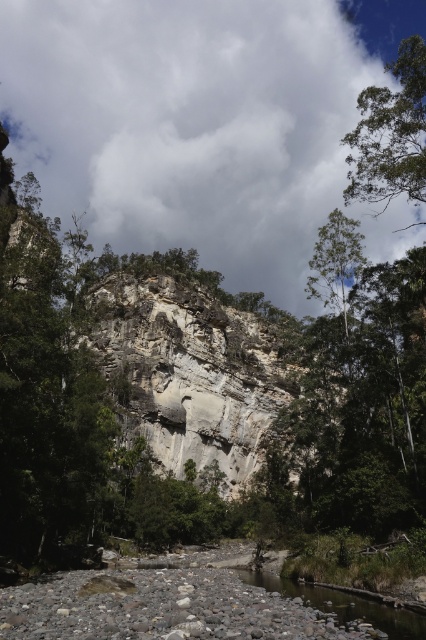
You are standing at point (190, 372) in the image. What object is located exactly at this point?

The gray rock formation at center is located exactly at point (190, 372).

You are an explorer standing at the base of the gray rock formation at center. You notice a green leafy tree at upper right. Which direction should you walk to reach the tree?

The gray rock formation at center is positioned under the green leafy tree at upper right, so you should walk upward or towards the upper right direction to reach the tree.

You are a hiker standing at the base of the cliff and want to cross the smooth gravel river at lower center. The green leafy tree at upper right is in your line of sight. Which object is closer to you, the tree or the river?

The smooth gravel river at lower center is closer to you than the green leafy tree at upper right because the tree is positioned further away in the upper right area of the scene.